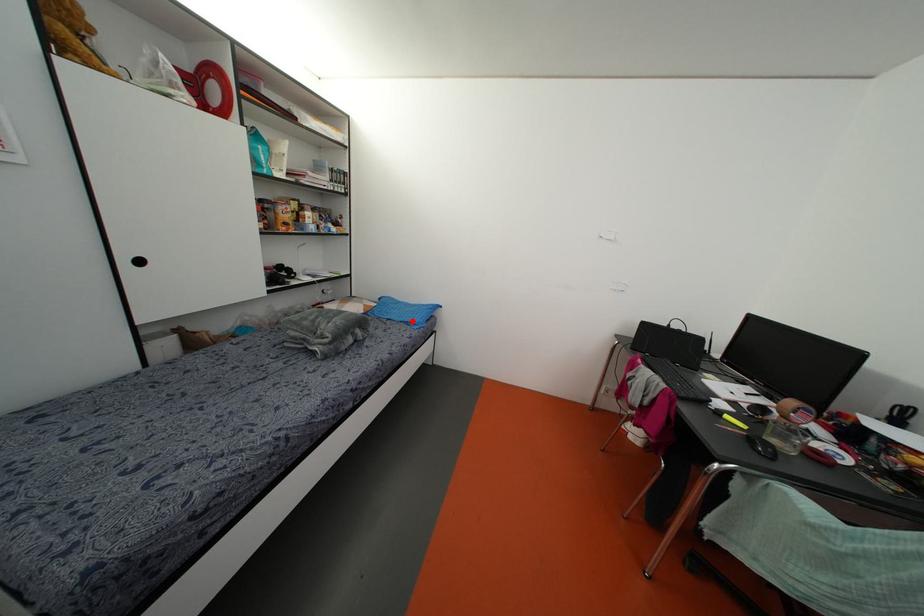
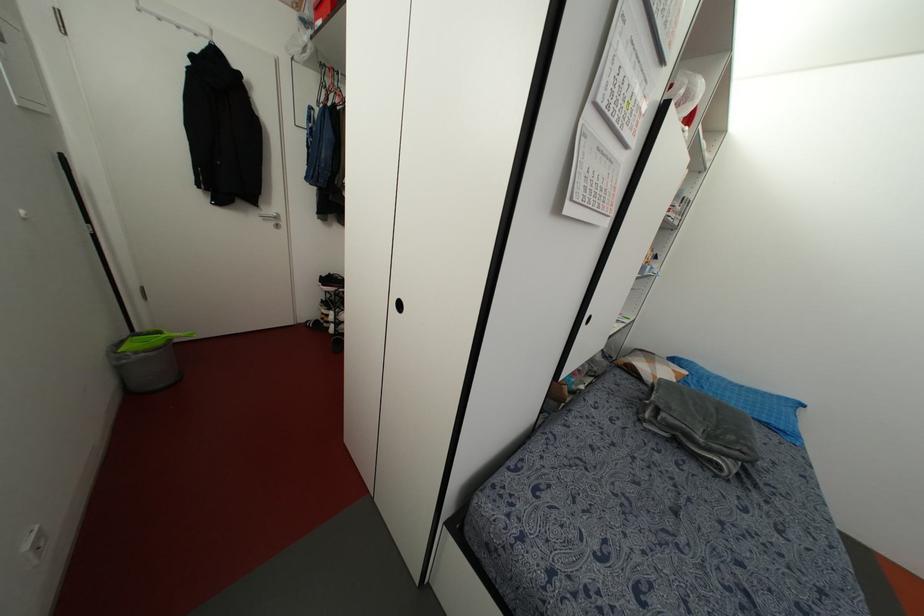
In the second image, find the point that corresponds to the highlighted location in the first image.

(782, 427)